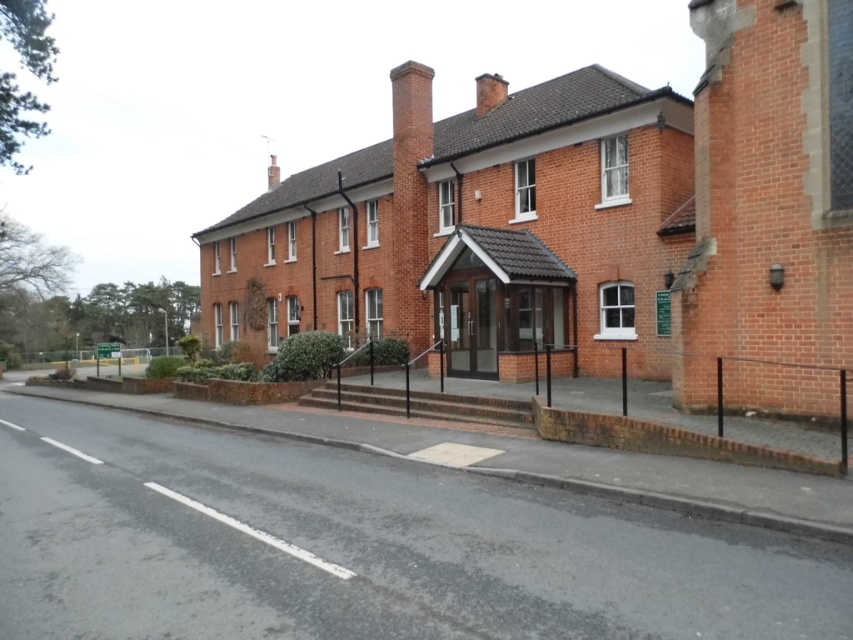
Question: Among these objects, which one is nearest to the camera?

Choices:
 (A) brick chimney at upper center
 (B) red brick chimney at center

Answer: (B)

Question: Is red brick chimney at center above brick chimney at upper center?

Choices:
 (A) no
 (B) yes

Answer: (A)

Question: Is red brick chimney at center smaller than brick chimney at upper center?

Choices:
 (A) no
 (B) yes

Answer: (B)

Question: Which point is closer to the camera?

Choices:
 (A) (268, 164)
 (B) (415, 333)

Answer: (B)

Question: Can you confirm if red brick chimney at center is bigger than brick chimney at upper center?

Choices:
 (A) no
 (B) yes

Answer: (A)

Question: Which object is closer to the camera taking this photo?

Choices:
 (A) red brick chimney at center
 (B) brick chimney at upper center

Answer: (A)